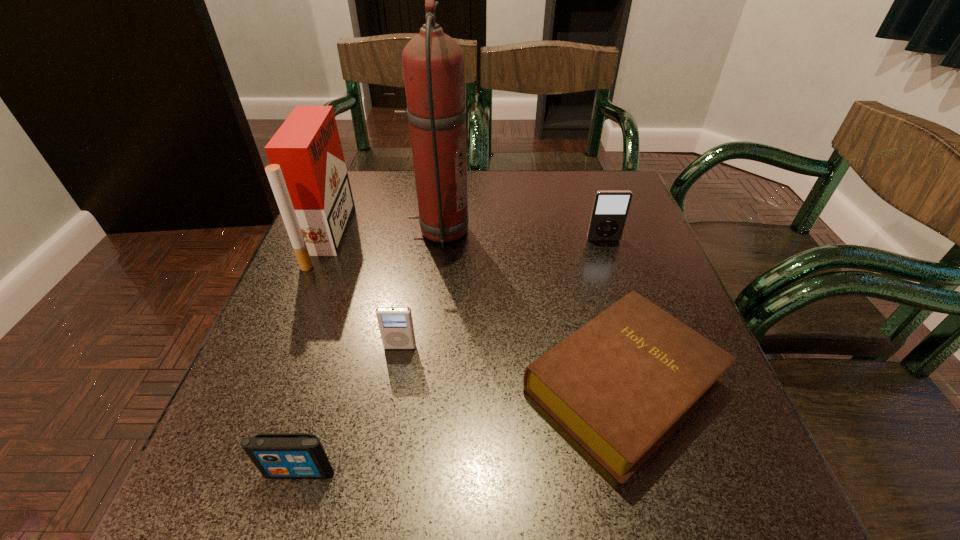
Where is `iPod that is at the right edge`? iPod that is at the right edge is located at coordinates (610, 209).

This screenshot has height=540, width=960. Identify the location of Bible that is positioned at the right edge. (622, 384).

Identify the location of object present at the far left corner. The image size is (960, 540). (307, 173).

Where is `object present at the near left corner`? object present at the near left corner is located at coordinates (276, 455).

The width and height of the screenshot is (960, 540). Identify the location of object that is at the near right corner. (622, 384).

Locate an element on the screen. This screenshot has height=540, width=960. vacant space at the far edge is located at coordinates (553, 174).

Where is `vacant area at the near edge`? The image size is (960, 540). vacant area at the near edge is located at coordinates (529, 498).

In the image, there is a desktop. Where is `vacant space at the left edge`? The image size is (960, 540). vacant space at the left edge is located at coordinates (297, 287).

The image size is (960, 540). I want to click on vacant point at the right edge, so click(x=650, y=245).

The width and height of the screenshot is (960, 540). I want to click on vacant region at the far left corner of the desktop, so click(x=372, y=208).